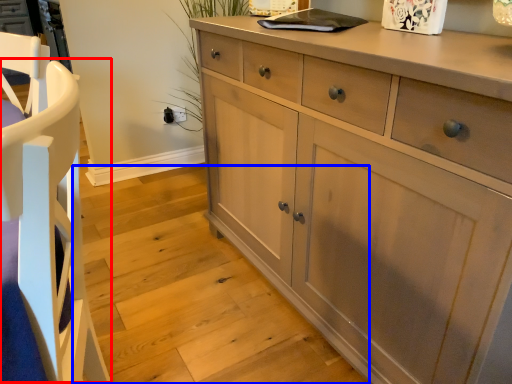
Question: Which point is further to the camera, armchair (highlighted by a red box) or stair (highlighted by a blue box)?

Choices:
 (A) armchair
 (B) stair

Answer: (B)